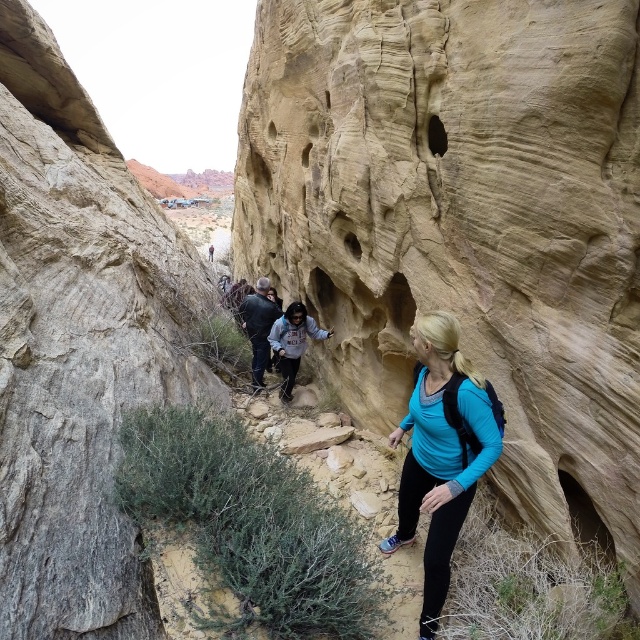
You are a hiker standing at the entrance of the canyon. You see a point marked at coordinates point [422,445]. If your hiking map states that the canyon wall starts at 15 meters away from the entrance, is the point located beyond the canyon wall?

The distance of point [422,445] from viewer is 17.18 meters, which is beyond the 15 meters mark where the canyon wall starts. Therefore, the point is located beyond the canyon wall.

You are a hiker in the canyon. You have a gray textured rock at left and a blue fabric backpack at center. Which object is positioned more to the left side of the scene?

The gray textured rock at left is positioned more to the left side of the scene than the blue fabric backpack at center.

You are a hiker trying to navigate through the canyon. You see the smooth sandstone rock face at center and the gray textured rock at left. Which rock formation is wider?

The smooth sandstone rock face at center is wider than the gray textured rock at left because its width surpasses the gray textured rock at left.